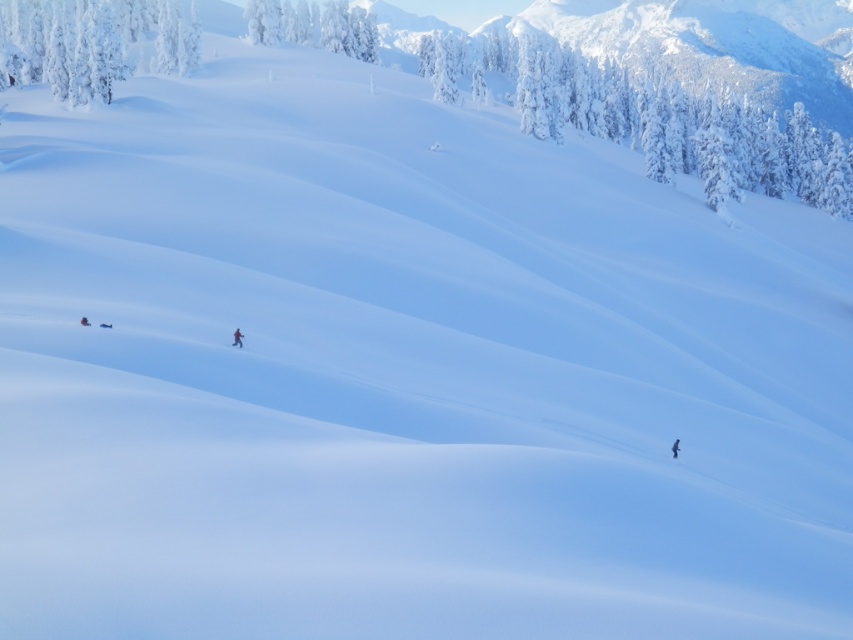
At what (x,y) coordinates should I click in order to perform the action: click on white frosty tree at upper center. Please return your answer as a coordinate pair (x, y). The image size is (853, 640). Looking at the image, I should click on (314, 26).

Is white frosty tree at upper center bigger than dark blue snowsuit at center?

Yes.

Who is more distant from viewer, (323,13) or (672,456)?

The point (323,13) is more distant.

This screenshot has width=853, height=640. Identify the location of white frosty tree at upper center. (314, 26).

Which of these two, white frosty tree at upper center or shiny red ski at center, stands taller?

Standing taller between the two is white frosty tree at upper center.

Is white frosty tree at upper center bigger than shiny red ski at center?

Indeed, white frosty tree at upper center has a larger size compared to shiny red ski at center.

Which is in front, point (335, 38) or point (231, 344)?

Point (231, 344) is more forward.

The image size is (853, 640). What are the coordinates of `white frosty tree at upper center` in the screenshot? It's located at (314, 26).

Does white frosty tree at upper center have a lesser height compared to white matte ski at lower right?

Incorrect, white frosty tree at upper center's height does not fall short of white matte ski at lower right's.

Does white frosty tree at upper center have a greater width compared to white matte ski at lower right?

Indeed, white frosty tree at upper center has a greater width compared to white matte ski at lower right.

Locate an element on the screen. The width and height of the screenshot is (853, 640). white frosty tree at upper center is located at coordinates (314, 26).

What are the coordinates of `white frosty tree at upper center` in the screenshot? It's located at (314, 26).